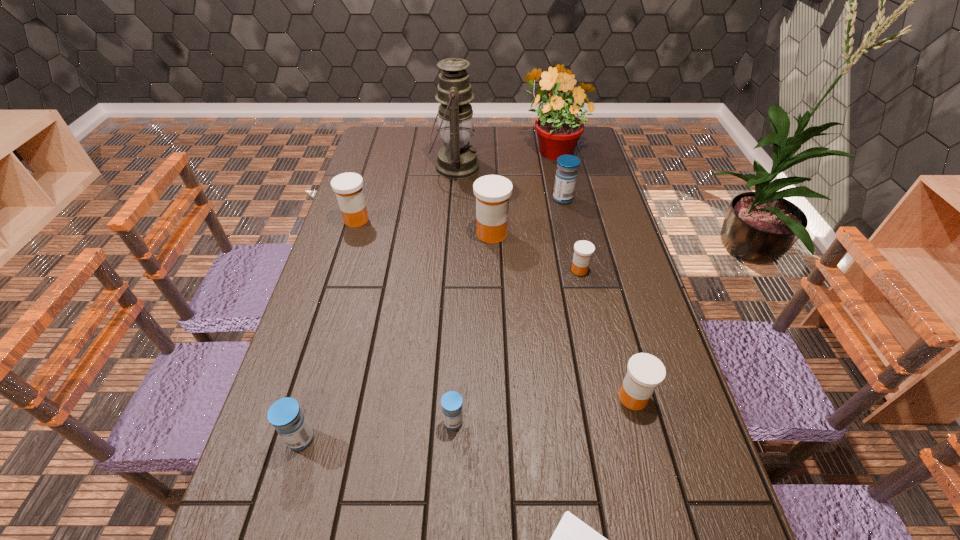
You are a GUI agent. You are given a task and a screenshot of the screen. Output one action in this format:
    pyautogui.click(x=<x>, y=<y>)
    Task: Click on the second nearest orange medicine
    The height and width of the screenshot is (540, 960).
    Given the screenshot: What is the action you would take?
    pyautogui.click(x=583, y=250)

Identify the location of the fourth farthest medicine. (583, 250).

What are the coordinates of `the smallest blue medicine` in the screenshot? It's located at (451, 401).

Locate an element on the screen. The image size is (960, 540). the second blue medicine from left to right is located at coordinates (451, 401).

At what (x,y) coordinates should I click in order to perform the action: click on free space located 0.340m on the front of the oil lamp. Please return your answer as a coordinate pair (x, y). Looking at the image, I should click on (449, 251).

Find the location of `free point located 0.190m on the left of the red flowerpot`. free point located 0.190m on the left of the red flowerpot is located at coordinates (470, 148).

Locate an element on the screen. vacant area situated 0.360m on the label of the tallest medicine is located at coordinates (360, 234).

Locate an element on the screen. The height and width of the screenshot is (540, 960). vacant space situated on the label of the tallest medicine is located at coordinates (404, 234).

Identify the location of vacant space located on the label of the tallest medicine. The image size is (960, 540). (411, 234).

What are the coordinates of `free point located on the label of the leftmost orange medicine` in the screenshot? It's located at (460, 220).